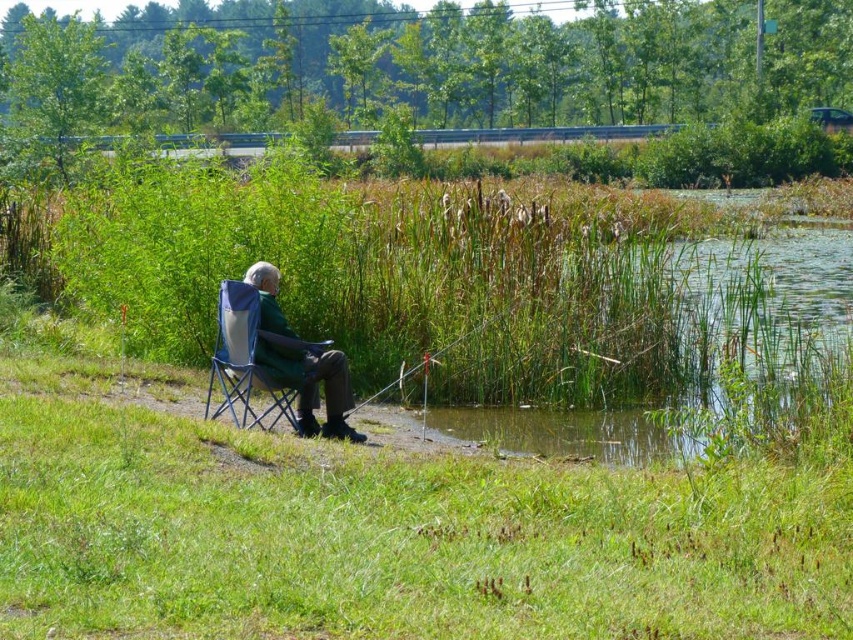
Is green fabric chair at center positioned in front of green fabric folding chair at center?

→ No, green fabric chair at center is further to the viewer.

Does green fabric chair at center have a smaller size compared to green fabric folding chair at center?

Incorrect, green fabric chair at center is not smaller in size than green fabric folding chair at center.

Between point (344, 381) and point (247, 316), which one is positioned in front?

Point (247, 316) is in front.

Where is `green fabric chair at center`? This screenshot has height=640, width=853. green fabric chair at center is located at coordinates (300, 362).

Can you confirm if green fabric chair at center is positioned to the right of metallic silver fishing pole at center?

Incorrect, green fabric chair at center is not on the right side of metallic silver fishing pole at center.

Is point (265, 307) positioned before point (482, 323)?

Yes, point (265, 307) is in front of point (482, 323).

You are a GUI agent. You are given a task and a screenshot of the screen. Output one action in this format:
    pyautogui.click(x=<x>, y=<y>)
    Task: Click on the green fabric chair at center
    This screenshot has width=853, height=640.
    Given the screenshot: What is the action you would take?
    pyautogui.click(x=300, y=362)

Which is more to the right, green fabric folding chair at center or metallic silver fishing pole at center?

metallic silver fishing pole at center

Is the position of green fabric folding chair at center more distant than that of metallic silver fishing pole at center?

No, green fabric folding chair at center is closer to the viewer.

Identify the location of green fabric folding chair at center. (242, 360).